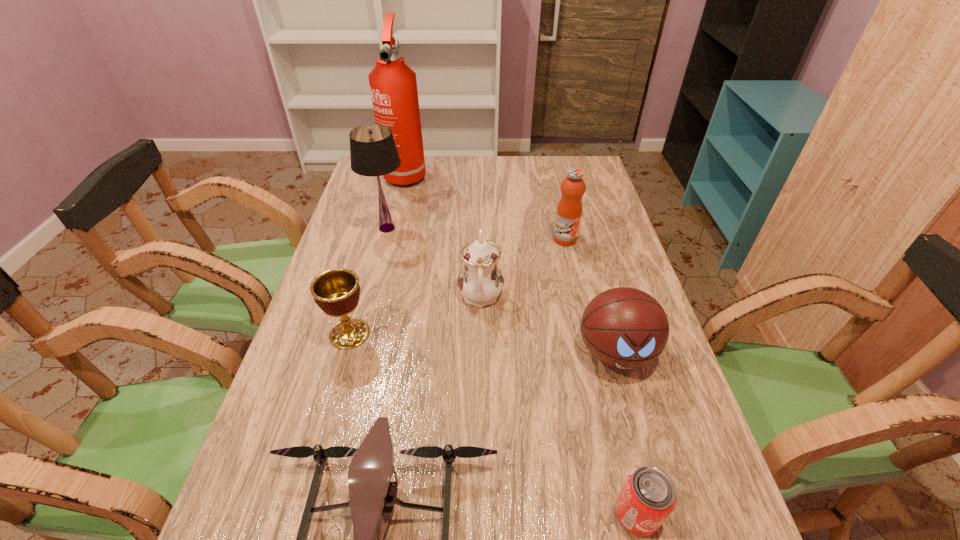
The width and height of the screenshot is (960, 540). What are the coordinates of `basketball located in the right edge section of the desktop` in the screenshot? It's located at (623, 327).

Where is `can at the right edge`? The width and height of the screenshot is (960, 540). can at the right edge is located at coordinates (648, 496).

This screenshot has height=540, width=960. I want to click on object that is at the far left corner, so click(393, 85).

Identify the location of vacant area at the far edge of the desktop. The width and height of the screenshot is (960, 540). (462, 157).

What are the coordinates of `vacant space at the left edge of the desktop` in the screenshot? It's located at click(x=365, y=217).

Find the location of a particular element. vacant space at the right edge of the desktop is located at coordinates (653, 404).

What are the coordinates of `vacant area at the far right corner of the desktop` in the screenshot? It's located at (567, 157).

Locate an element on the screen. free space between the chalice and the seventh shortest object is located at coordinates 369,281.

I want to click on vacant space that's between the chinaware and the lampshade, so click(x=434, y=262).

Locate an element on the screen. free area in between the fruit juice and the lampshade is located at coordinates (476, 234).